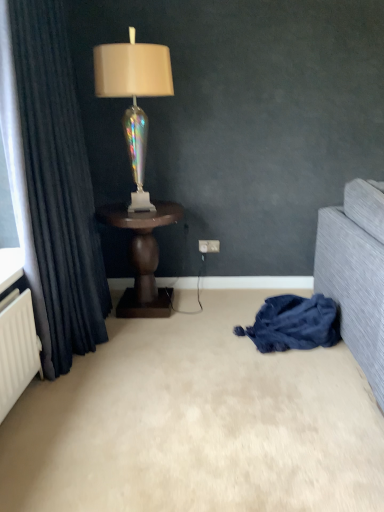
Question: Is iridescent glass lamp at center further to the viewer compared to white plastic electric outlet at center?

Choices:
 (A) yes
 (B) no

Answer: (B)

Question: Is iridescent glass lamp at center not near white plastic electric outlet at center?

Choices:
 (A) yes
 (B) no

Answer: (A)

Question: Considering the relative sizes of iridescent glass lamp at center and white plastic electric outlet at center in the image provided, is iridescent glass lamp at center smaller than white plastic electric outlet at center?

Choices:
 (A) no
 (B) yes

Answer: (A)

Question: Is white plastic electric outlet at center at the back of iridescent glass lamp at center?

Choices:
 (A) yes
 (B) no

Answer: (B)

Question: From a real-world perspective, does iridescent glass lamp at center stand above white plastic electric outlet at center?

Choices:
 (A) yes
 (B) no

Answer: (A)

Question: In the image, is dark wood side table at center on the left side or the right side of beige carpet at lower center?

Choices:
 (A) left
 (B) right

Answer: (A)

Question: Which is correct: dark wood side table at center is inside beige carpet at lower center, or outside of it?

Choices:
 (A) outside
 (B) inside

Answer: (A)

Question: Is point (178, 209) closer or farther from the camera than point (314, 349)?

Choices:
 (A) farther
 (B) closer

Answer: (A)

Question: From the image's perspective, is dark wood side table at center positioned above or below beige carpet at lower center?

Choices:
 (A) above
 (B) below

Answer: (A)

Question: Is dark wood side table at center wider or thinner than iridescent glass lamp at center?

Choices:
 (A) wide
 (B) thin

Answer: (A)

Question: Relative to iridescent glass lamp at center, is dark wood side table at center in front or behind?

Choices:
 (A) front
 (B) behind

Answer: (B)

Question: In terms of height, does dark wood side table at center look taller or shorter compared to iridescent glass lamp at center?

Choices:
 (A) short
 (B) tall

Answer: (A)

Question: Considering the positions of dark wood side table at center and iridescent glass lamp at center in the image, is dark wood side table at center bigger or smaller than iridescent glass lamp at center?

Choices:
 (A) small
 (B) big

Answer: (B)

Question: Does point (115, 359) appear closer or farther from the camera than point (148, 74)?

Choices:
 (A) closer
 (B) farther

Answer: (A)

Question: Is beige carpet at lower center situated inside iridescent glass lamp at center or outside?

Choices:
 (A) inside
 (B) outside

Answer: (B)